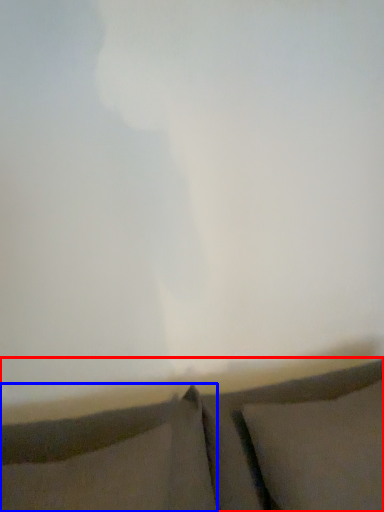
Question: Which object appears closest to the camera in this image, furniture (highlighted by a red box) or pillow (highlighted by a blue box)?

Choices:
 (A) furniture
 (B) pillow

Answer: (A)